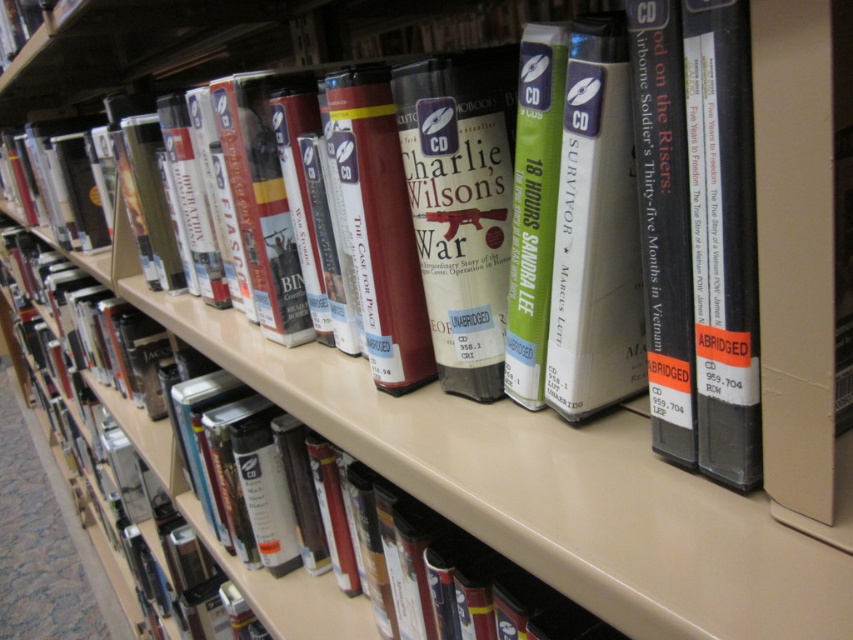
You are organizing a library shelf and need to place both the matte gray cd at center and the black hardcover book at center. Since you want to arrange items by size, which one should be placed first if you are starting from the bottom?

The matte gray cd at center has a greater height compared to the black hardcover book at center, so it should be placed first at the bottom to accommodate its larger size.

You are organizing a library shelf and need to place a new item between the matte gray cd at center and the black hardcover book at center. The new item is 2.5 inches wide. Can it fit in the space between them?

The space between the matte gray cd at center and the black hardcover book at center is 3.12 inches. Since the new item is 2.5 inches wide, it can fit in the available space.

You are standing in front of the library shelf and want to locate two specific points on the shelf. The first point is at coordinates point (579,141) and the second is at point (726,115). Which point is closer to you?

Point (579,141) is closer to you because it is further to the camera than point (726,115).